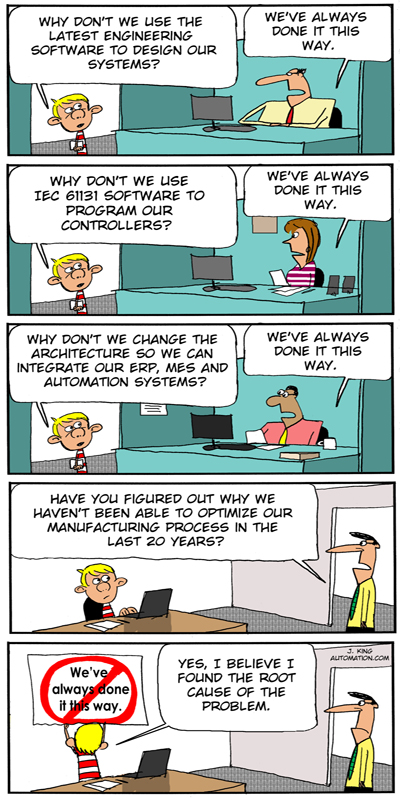
Image resolution: width=400 pixels, height=800 pixels. Find the location of `desktop computer monitor`. desktop computer monitor is located at coordinates (213, 96), (213, 258), (216, 429).